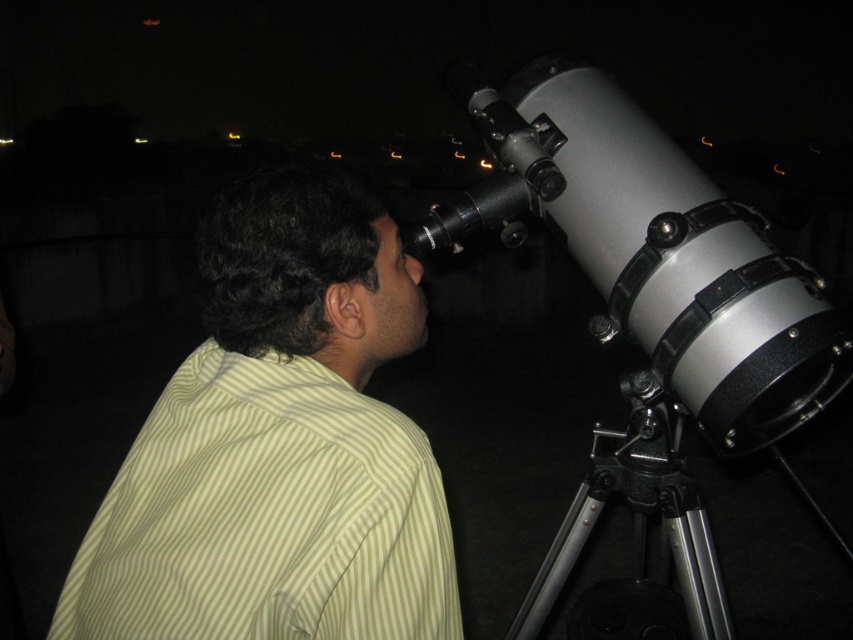
Question: Which point is farther from the camera taking this photo?

Choices:
 (A) (628, 106)
 (B) (277, 388)

Answer: (A)

Question: Can you confirm if light yellow striped shirt at center is positioned to the left of silver metallic telescope at right?

Choices:
 (A) no
 (B) yes

Answer: (B)

Question: Is light yellow striped shirt at center wider than silver metallic telescope at right?

Choices:
 (A) no
 (B) yes

Answer: (A)

Question: Is light yellow striped shirt at center smaller than silver metallic telescope at right?

Choices:
 (A) yes
 (B) no

Answer: (A)